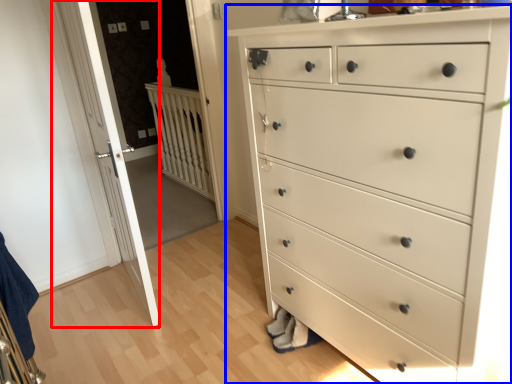
Question: Which point is closer to the camera, door (highlighted by a red box) or chest of drawers (highlighted by a blue box)?

Choices:
 (A) door
 (B) chest of drawers

Answer: (B)